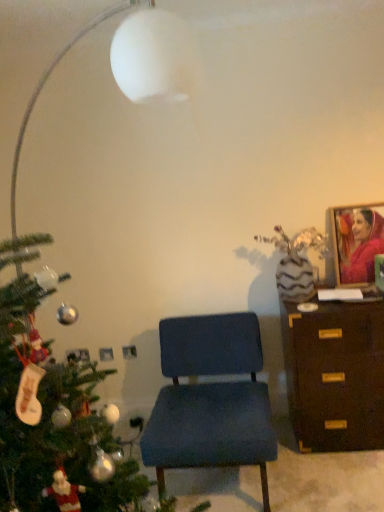
Locate an element on the screen. Image resolution: width=384 pixels, height=512 pixels. vacant region in front of brown wooden chest of drawers at right is located at coordinates (343, 479).